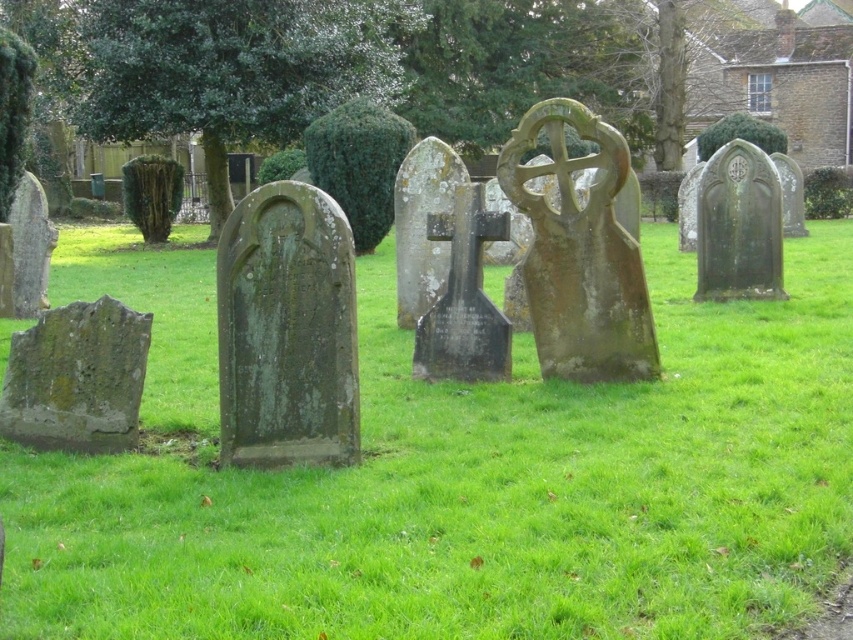
You are a groundskeeper in the cemetery and need to determine which of the two green stones is shorter. Which one is shorter between the green mossy stone at lower left and the green stone gravestone at right?

The green mossy stone at lower left is not as tall as the green stone gravestone at right, so the green mossy stone at lower left is shorter.

You are standing at the entrance of the cemetery and notice the green mossy stone at lower left and the green stone gravestone at right. Which object is closer to you?

The green mossy stone at lower left is positioned under the green stone gravestone at right, so the green mossy stone at lower left is closer to you.

You are a gardener trying to maintain the cemetery. You need to place a new small flower pot between the green mossy grass at center and the green stone gravestone at right. Which object should you place the flower pot closer to if you want it to be closer to the larger area?

The green mossy grass at center has a larger size compared to the green stone gravestone at right, so placing the flower pot closer to the green mossy grass at center would ensure it is near the larger area.